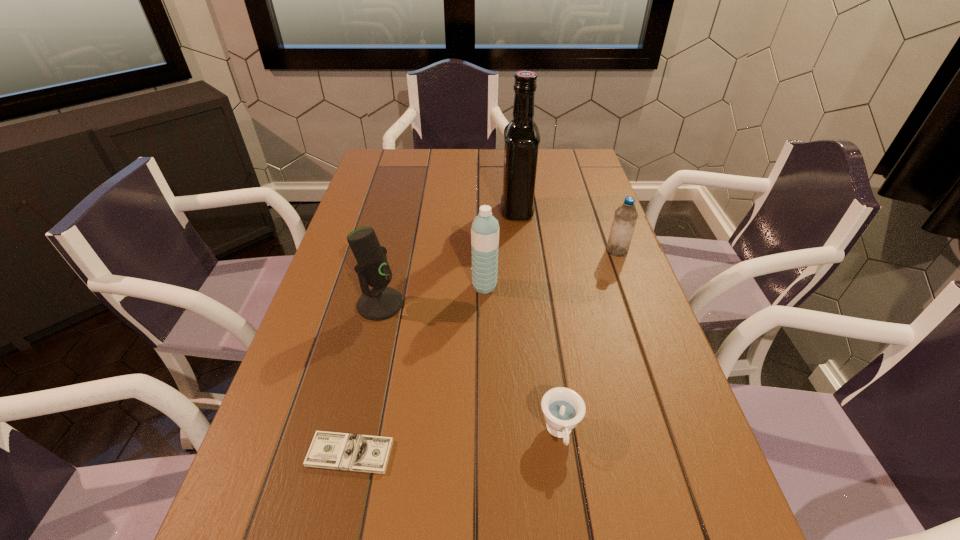
Find the location of `empty space that is in between the teacup and the tallest object`. empty space that is in between the teacup and the tallest object is located at coordinates (539, 321).

This screenshot has width=960, height=540. Identify the location of free space that is in between the microphone and the second shortest object. (470, 368).

Where is `vacant area that lies between the teacup and the left water bottle`? The width and height of the screenshot is (960, 540). vacant area that lies between the teacup and the left water bottle is located at coordinates (522, 359).

Where is `vacant area that lies between the tallest object and the dollar`? The height and width of the screenshot is (540, 960). vacant area that lies between the tallest object and the dollar is located at coordinates (434, 332).

Identify which object is the second closest to the farthest object. Please provide its 2D coordinates. Your answer should be formatted as a tuple, i.e. [(x, y)], where the tuple contains the x and y coordinates of a point satisfying the conditions above.

[(485, 228)]

I want to click on object that stands as the closest to the farthest object, so click(625, 217).

This screenshot has width=960, height=540. Identify the location of blank space that satisfies the following two spatial constraints: 1. on the back side of the right water bottle; 2. on the front-facing side of the tallest object. (602, 210).

You are a GUI agent. You are given a task and a screenshot of the screen. Output one action in this format:
    pyautogui.click(x=<x>, y=<y>)
    Task: Click on the free space that satisfies the following two spatial constraints: 1. on the front-facing side of the liquor; 2. on the left side of the right water bottle
    
    Given the screenshot: What is the action you would take?
    pyautogui.click(x=521, y=251)

You are a GUI agent. You are given a task and a screenshot of the screen. Output one action in this format:
    pyautogui.click(x=<x>, y=<y>)
    Task: Click on the free location that satisfies the following two spatial constraints: 1. on the front-facing side of the tallest object; 2. on the right side of the third shortest object
    The width and height of the screenshot is (960, 540).
    Given the screenshot: What is the action you would take?
    pyautogui.click(x=521, y=251)

You are a GUI agent. You are given a task and a screenshot of the screen. Output one action in this format:
    pyautogui.click(x=<x>, y=<y>)
    Task: Click on the free region that satisfies the following two spatial constraints: 1. on the front-facing side of the farthest object; 2. on the front side of the microphone
    The width and height of the screenshot is (960, 540).
    Given the screenshot: What is the action you would take?
    pyautogui.click(x=528, y=304)